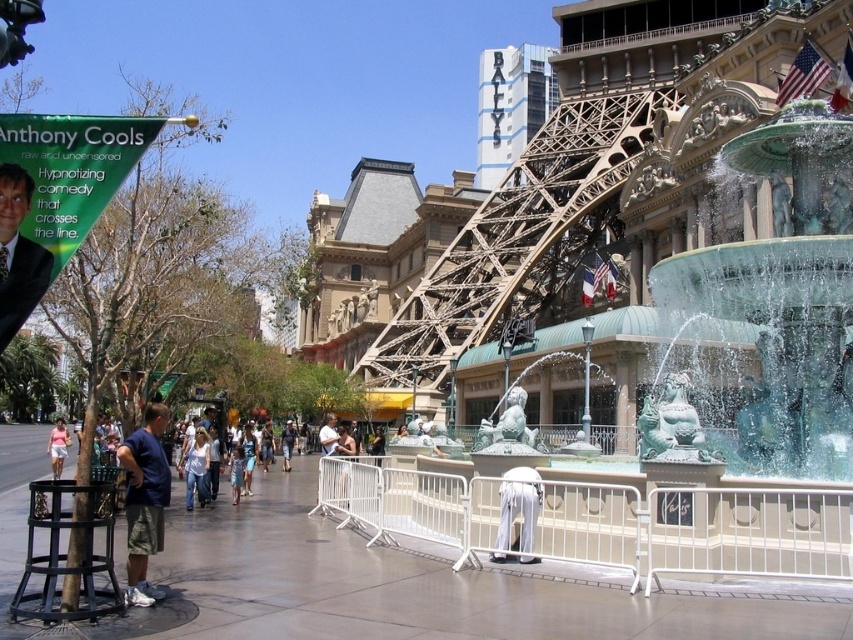
Who is shorter, translucent glass fountain at center right or denim jeans at center?

Standing shorter between the two is denim jeans at center.

Is translucent glass fountain at center right below denim jeans at center?

No, translucent glass fountain at center right is not below denim jeans at center.

Where is `translucent glass fountain at center right`? The width and height of the screenshot is (853, 640). translucent glass fountain at center right is located at coordinates (784, 285).

Does blue cotton shirt at center lie in front of light pink cotton shirt at center?

Yes.

The width and height of the screenshot is (853, 640). Find the location of `blue cotton shirt at center`. blue cotton shirt at center is located at coordinates (144, 500).

You are a GUI agent. You are given a task and a screenshot of the screen. Output one action in this format:
    pyautogui.click(x=<x>, y=<y>)
    Task: Click on the blue cotton shirt at center
    This screenshot has height=640, width=853.
    Given the screenshot: What is the action you would take?
    pyautogui.click(x=144, y=500)

Is point (820, 205) positioned before point (152, 532)?

No, (820, 205) is behind (152, 532).

Does translucent glass fountain at center right have a lesser width compared to blue cotton shirt at center?

Incorrect, translucent glass fountain at center right's width is not less than blue cotton shirt at center's.

Is point (840, 531) behind point (151, 412)?

No, it is not.

Find the location of a particular element. translucent glass fountain at center right is located at coordinates tap(784, 285).